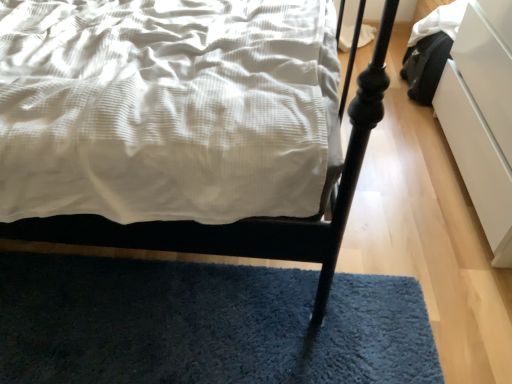
Question: Is white glossy drawer at right facing away from matte white bed at center?

Choices:
 (A) yes
 (B) no

Answer: (B)

Question: Is white glossy drawer at right placed right next to matte white bed at center?

Choices:
 (A) yes
 (B) no

Answer: (B)

Question: Considering the relative positions of white glossy drawer at right and matte white bed at center in the image provided, is white glossy drawer at right to the left of matte white bed at center from the viewer's perspective?

Choices:
 (A) yes
 (B) no

Answer: (B)

Question: Is white glossy drawer at right wider than matte white bed at center?

Choices:
 (A) yes
 (B) no

Answer: (B)

Question: Does white glossy drawer at right have a larger size compared to matte white bed at center?

Choices:
 (A) yes
 (B) no

Answer: (B)

Question: Relative to white glossy drawer at right, is blue shaggy rug at lower center in front or behind?

Choices:
 (A) behind
 (B) front

Answer: (A)

Question: In terms of height, does blue shaggy rug at lower center look taller or shorter compared to white glossy drawer at right?

Choices:
 (A) short
 (B) tall

Answer: (A)

Question: From a real-world perspective, is blue shaggy rug at lower center above or below white glossy drawer at right?

Choices:
 (A) below
 (B) above

Answer: (A)

Question: Considering the positions of blue shaggy rug at lower center and white glossy drawer at right in the image, is blue shaggy rug at lower center wider or thinner than white glossy drawer at right?

Choices:
 (A) thin
 (B) wide

Answer: (B)

Question: From their relative heights in the image, would you say matte white bed at center is taller or shorter than white glossy drawer at right?

Choices:
 (A) tall
 (B) short

Answer: (A)

Question: Looking at their shapes, would you say matte white bed at center is wider or thinner than white glossy drawer at right?

Choices:
 (A) thin
 (B) wide

Answer: (B)

Question: In terms of size, does matte white bed at center appear bigger or smaller than white glossy drawer at right?

Choices:
 (A) small
 (B) big

Answer: (B)

Question: Based on their positions, is matte white bed at center located to the left or right of white glossy drawer at right?

Choices:
 (A) left
 (B) right

Answer: (A)

Question: Is blue shaggy rug at lower center to the left or to the right of matte white bed at center in the image?

Choices:
 (A) right
 (B) left

Answer: (A)

Question: Is blue shaggy rug at lower center taller or shorter than matte white bed at center?

Choices:
 (A) short
 (B) tall

Answer: (A)